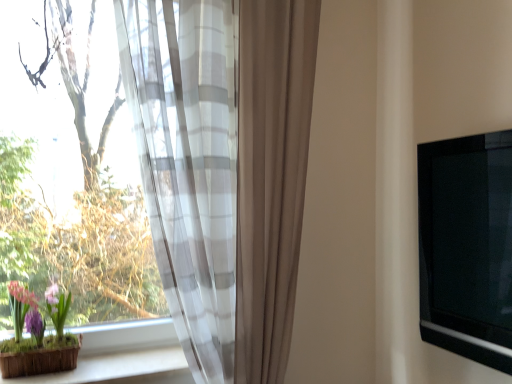
Locate an element on the screen. This screenshot has width=512, height=384. free region under transparent fabric at left (from a real-world perspective) is located at coordinates (122, 366).